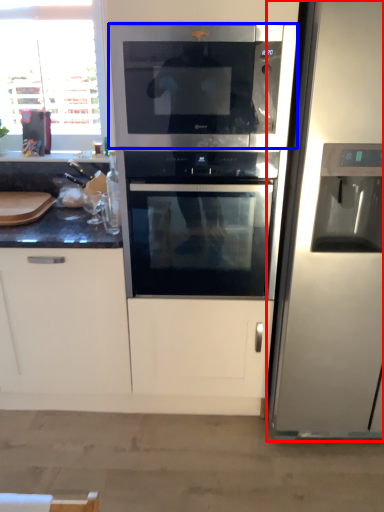
Question: Among these objects, which one is farthest to the camera, refrigerator (highlighted by a red box) or microwave oven (highlighted by a blue box)?

Choices:
 (A) refrigerator
 (B) microwave oven

Answer: (B)